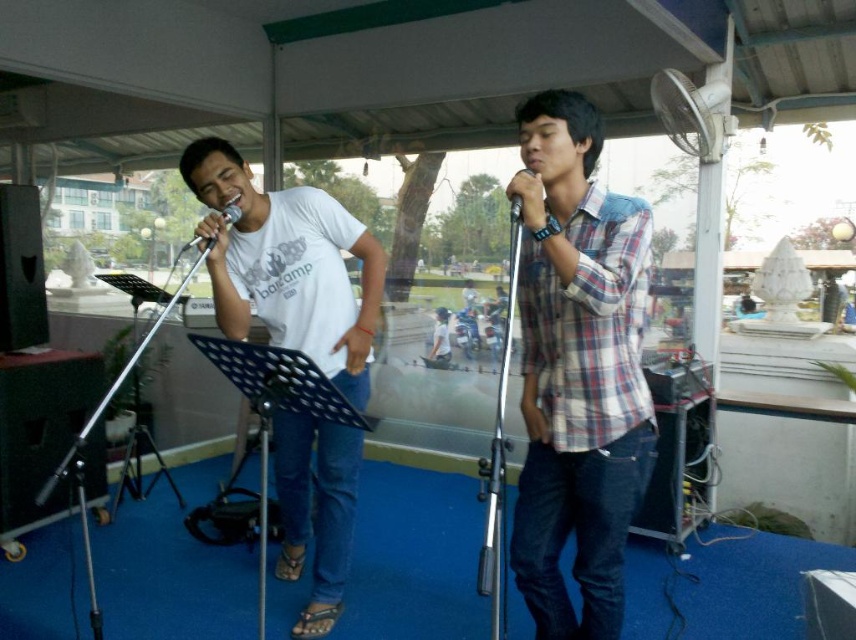
Question: Can you confirm if plaid cotton shirt at center is wider than black matte microphone at center?

Choices:
 (A) yes
 (B) no

Answer: (A)

Question: Which object is positioned farthest from the black matte microphone at center?

Choices:
 (A) plaid cotton shirt at center
 (B) matte silver microphone at center

Answer: (B)

Question: Estimate the real-world distances between objects in this image. Which object is farther from the black matte microphone at center?

Choices:
 (A) white matte t-shirt at center
 (B) plaid cotton shirt at center
 (C) matte silver microphone at center

Answer: (A)

Question: Does plaid cotton shirt at center appear under black matte microphone at center?

Choices:
 (A) yes
 (B) no

Answer: (A)

Question: Can you confirm if plaid cotton shirt at center is positioned to the right of black matte microphone at center?

Choices:
 (A) yes
 (B) no

Answer: (A)

Question: Which point is closer to the camera taking this photo?

Choices:
 (A) (556, 284)
 (B) (514, 198)
 (C) (313, 204)

Answer: (B)